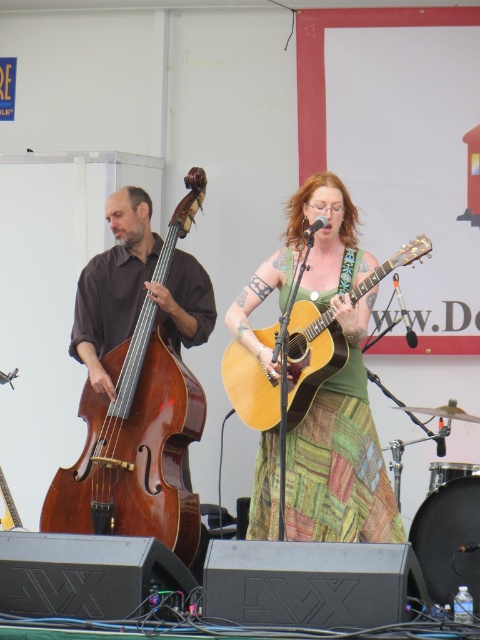
You are a stagehand setting up the lighting for the performance. You need to ensure that both the brown polished wood cello at left and the brown matte double bass at left are well illuminated. Given their positions and sizes, which instrument should you adjust the spotlight for first to account for its size?

The brown polished wood cello at left is taller than the brown matte double bass at left, so you should adjust the spotlight for the brown polished wood cello at left first to accommodate its greater height.

You are a photographer at the event and want to capture a photo that includes both the brown matte double bass at left and the light brown acoustic guitar at center. Based on their positions, which instrument should you focus on first to ensure both are in frame?

The light brown acoustic guitar at center is behind the brown matte double bass at left, so you should focus on the brown matte double bass at left first to ensure both are in frame.